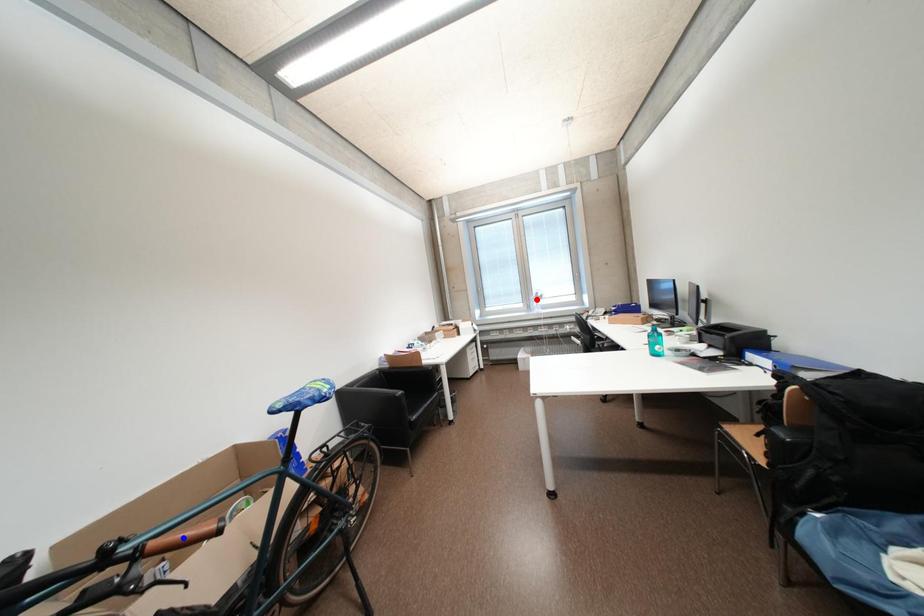
Question: In the image, two points are highlighted. Which point is nearer to the camera? Reply with the corresponding letter.

Choices:
 (A) blue point
 (B) red point

Answer: (A)